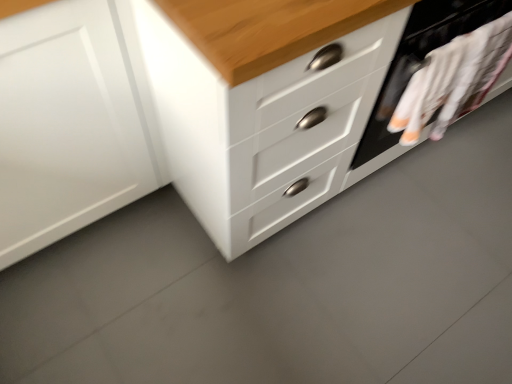
Question: Does white glossy chest of drawers at center have a lesser width compared to white matte cabinet at left?

Choices:
 (A) no
 (B) yes

Answer: (A)

Question: Is white glossy chest of drawers at center far away from white matte cabinet at left?

Choices:
 (A) yes
 (B) no

Answer: (B)

Question: Does white glossy chest of drawers at center touch white matte cabinet at left?

Choices:
 (A) yes
 (B) no

Answer: (B)

Question: Does white glossy chest of drawers at center contain white matte cabinet at left?

Choices:
 (A) yes
 (B) no

Answer: (B)

Question: Does white glossy chest of drawers at center have a smaller size compared to white matte cabinet at left?

Choices:
 (A) yes
 (B) no

Answer: (B)

Question: From a real-world perspective, is white glossy chest of drawers at center positioned under white matte cabinet at left based on gravity?

Choices:
 (A) no
 (B) yes

Answer: (A)

Question: Is white matte cabinet at left outside white glossy chest of drawers at center?

Choices:
 (A) yes
 (B) no

Answer: (A)

Question: Is the surface of white matte cabinet at left in direct contact with white glossy chest of drawers at center?

Choices:
 (A) yes
 (B) no

Answer: (B)

Question: Could you tell me if white matte cabinet at left is turned towards white glossy chest of drawers at center?

Choices:
 (A) no
 (B) yes

Answer: (A)

Question: From a real-world perspective, is white matte cabinet at left on top of white glossy chest of drawers at center?

Choices:
 (A) no
 (B) yes

Answer: (A)

Question: From the image's perspective, is white matte cabinet at left over white glossy chest of drawers at center?

Choices:
 (A) no
 (B) yes

Answer: (A)

Question: Can you confirm if white matte cabinet at left is thinner than white glossy chest of drawers at center?

Choices:
 (A) yes
 (B) no

Answer: (A)

Question: Is white fabric at right bigger than white glossy chest of drawers at center?

Choices:
 (A) yes
 (B) no

Answer: (B)